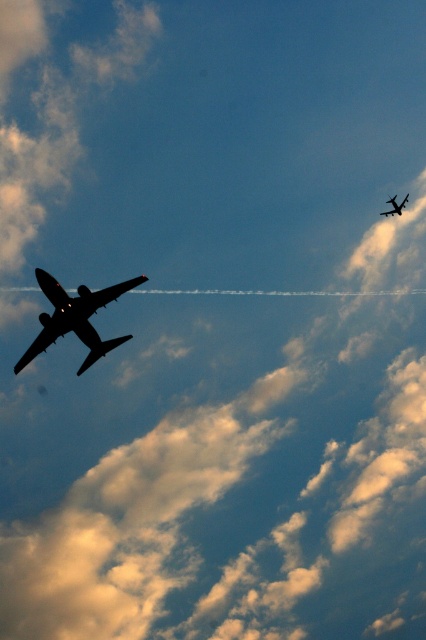
You are a drone operator trying to capture aerial footage. You notice two points marked in the scene. Which point, point (97, 296) or point (394, 209), is closer to your camera lens?

Point (97, 296) is closer to the camera lens than point (394, 209).

You are a pilot observing the two silhouette metallic airplanes in the sky. Which airplane would appear larger to you, the silhouette metallic airplane at left or the silhouette metallic airplane at upper center?

The silhouette metallic airplane at left appears larger because it is closer to the viewer than the silhouette metallic airplane at upper center.

You are a pilot flying a small drone that has a maximum flight range of 55 meters. You want to fly your drone from the silhouette metallic airplane at left to the silhouette metallic airplane at upper center. Can your drone reach the destination without running out of battery?

The silhouette metallic airplane at left and silhouette metallic airplane at upper center are 56.10 meters apart from each other. Since the drone can only fly 55 meters, it cannot reach the destination without running out of battery.